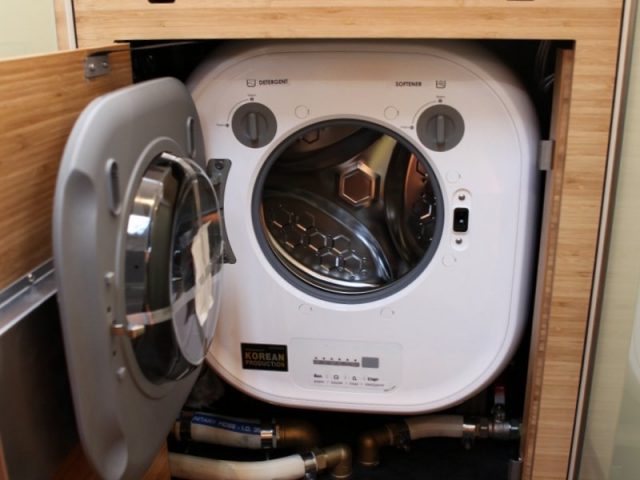
The image size is (640, 480). Find the location of `gray washing machine door`. gray washing machine door is located at coordinates (100, 309), (124, 152), (132, 419), (166, 119).